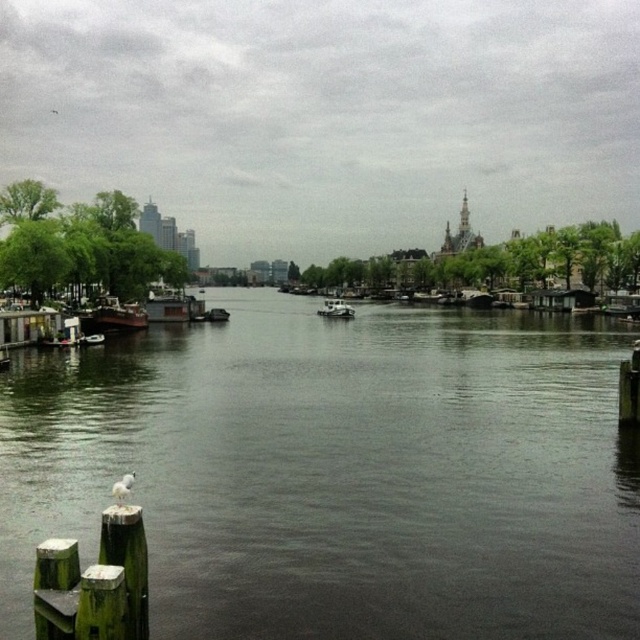
You are standing at the point with coordinates point [339,472]. Based on the scene description, what is the color of the surface you are currently standing on?

The point [339,472] corresponds to dark gray water at center, so the surface you are standing on is dark gray in color.

You are standing on the dock and want to throw a pebble into the dark gray water at center and the wooden houseboat at left. Which one will the pebble reach first if you throw it with the same force?

The dark gray water at center will be reached first because it is closer to the viewer than the wooden houseboat at left.